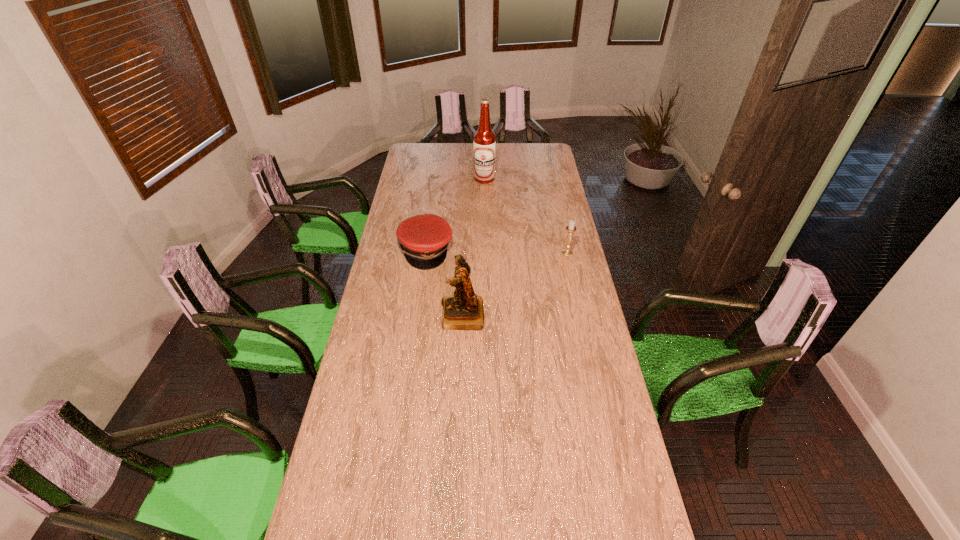
I want to click on vacant spot on the desktop that is between the figurine and the second shortest object and is positioned on the front-facing side of the shortest object, so click(x=510, y=287).

The height and width of the screenshot is (540, 960). In order to click on free spot on the desktop that is between the second tallest object and the second shortest object and is positioned on the label side of the alcohol in this screenshot , I will do `click(528, 276)`.